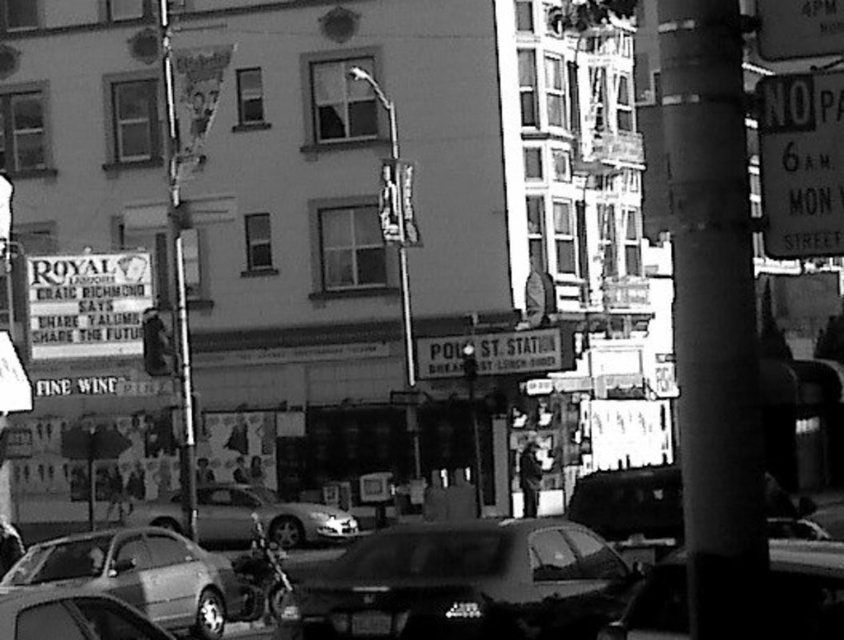
Is metallic silver car at center taller than metallic gray sedan at lower left?

Correct, metallic silver car at center is much taller as metallic gray sedan at lower left.

Can you confirm if metallic silver car at center is positioned above metallic gray sedan at lower left?

Result: Yes.

Does point (809, 564) lie behind point (96, 636)?

That is False.

Locate an element on the screen. Image resolution: width=844 pixels, height=640 pixels. metallic silver car at center is located at coordinates (805, 588).

Is metallic silver car at lower left positioned at the back of metallic silver car at center?

That is True.

Which is more to the left, metallic silver car at lower left or metallic silver car at center?

metallic silver car at lower left

The image size is (844, 640). Identify the location of metallic silver car at lower left. (139, 576).

Who is positioned more to the right, white paper sign at left or silver metallic car at center?

Positioned to the right is silver metallic car at center.

Who is shorter, white paper sign at left or silver metallic car at center?

silver metallic car at center

Who is more distant from viewer, (117, 301) or (176, 513)?

Positioned behind is point (176, 513).

You are a GUI agent. You are given a task and a screenshot of the screen. Output one action in this format:
    pyautogui.click(x=<x>, y=<y>)
    Task: Click on the white paper sign at left
    The width and height of the screenshot is (844, 640).
    Given the screenshot: What is the action you would take?
    pyautogui.click(x=87, y=305)